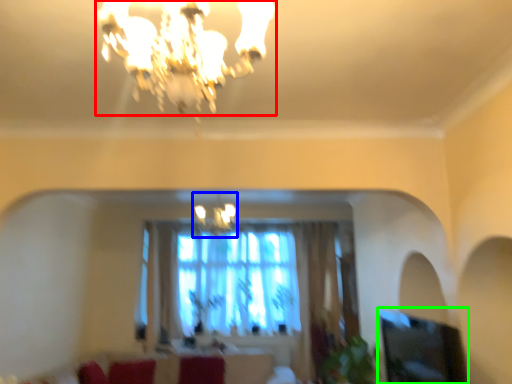
Question: Which is nearer to the lamp (highlighted by a red box)? lamp (highlighted by a blue box) or window screen (highlighted by a green box).

Choices:
 (A) lamp
 (B) window screen

Answer: (B)